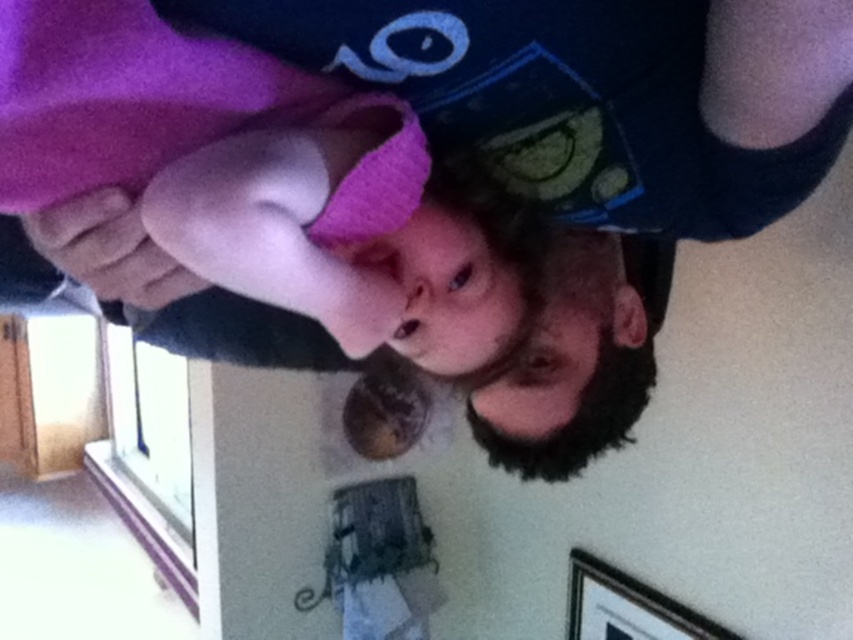
Based on the scene description, if you were standing in the room facing the wall with the wooden picture frame at lower right, would the purple fleece at upper left be located to your left or right side?

The purple fleece at upper left is above the wooden picture frame at lower right, so when facing the wooden picture frame at lower right, the purple fleece at upper left would be directly above it, not to the left or right side.

You are standing in a room and see the purple fleece at upper left and the wooden picture frame at lower right. Which object is closer to you?

The purple fleece at upper left is closer to you because it is in front of the wooden picture frame at lower right.